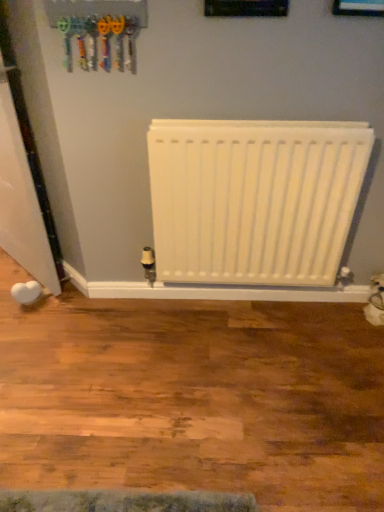
Question: Is white glossy door at left taller than white matte radiator at center?

Choices:
 (A) yes
 (B) no

Answer: (A)

Question: Is white glossy door at left directly adjacent to white matte radiator at center?

Choices:
 (A) yes
 (B) no

Answer: (B)

Question: Is white matte radiator at center completely or partially inside white glossy door at left?

Choices:
 (A) no
 (B) yes

Answer: (A)

Question: Is white glossy door at left looking in the opposite direction of white matte radiator at center?

Choices:
 (A) no
 (B) yes

Answer: (A)

Question: Is white glossy door at left further to camera compared to white matte radiator at center?

Choices:
 (A) no
 (B) yes

Answer: (A)

Question: Is point (162, 267) closer or farther from the camera than point (97, 54)?

Choices:
 (A) farther
 (B) closer

Answer: (A)

Question: Is white matte radiator at center bigger or smaller than plastic toy keys at upper left?

Choices:
 (A) small
 (B) big

Answer: (B)

Question: Is white matte radiator at center in front of or behind plastic toy keys at upper left in the image?

Choices:
 (A) front
 (B) behind

Answer: (B)

Question: In terms of height, does white matte radiator at center look taller or shorter compared to plastic toy keys at upper left?

Choices:
 (A) short
 (B) tall

Answer: (B)

Question: Is blue glossy picture frame at upper center in front of or behind plastic toy keys at upper left in the image?

Choices:
 (A) behind
 (B) front

Answer: (B)

Question: In terms of size, does blue glossy picture frame at upper center appear bigger or smaller than plastic toy keys at upper left?

Choices:
 (A) small
 (B) big

Answer: (A)

Question: Based on their positions, is blue glossy picture frame at upper center located to the left or right of plastic toy keys at upper left?

Choices:
 (A) left
 (B) right

Answer: (B)

Question: Is blue glossy picture frame at upper center inside or outside of plastic toy keys at upper left?

Choices:
 (A) outside
 (B) inside

Answer: (A)

Question: Looking at the image, does white glossy door at left seem bigger or smaller compared to white matte radiator at center?

Choices:
 (A) small
 (B) big

Answer: (B)

Question: In terms of width, does white glossy door at left look wider or thinner when compared to white matte radiator at center?

Choices:
 (A) thin
 (B) wide

Answer: (B)